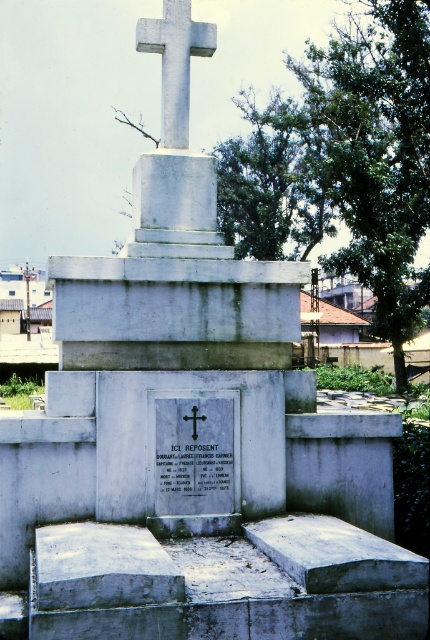
You are standing in front of the tombstone monument and want to place two flowers at the points labeled point (189, 61) and point (194, 419). Which point is closer to you when viewed from the front?

Point (194, 419) is closer to you because point (189, 61) is behind it when viewed from the front.